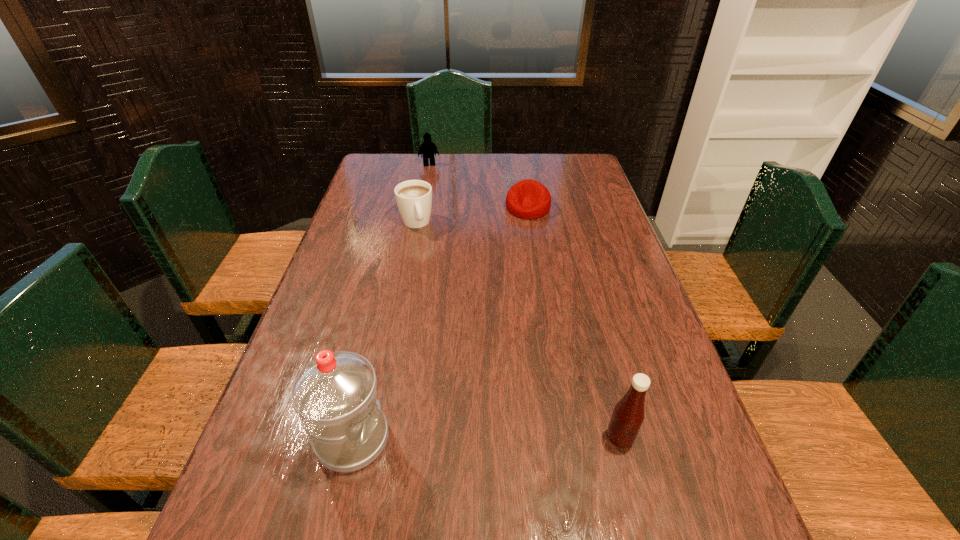
I want to click on free space between the second object from right to left and the second tallest object, so click(x=574, y=323).

Image resolution: width=960 pixels, height=540 pixels. I want to click on empty space that is in between the water bottle and the fourth shortest object, so click(x=486, y=438).

Locate an element on the screen. This screenshot has height=540, width=960. blank region between the tallest object and the farthest object is located at coordinates (391, 302).

The image size is (960, 540). I want to click on free point between the second tallest object and the water bottle, so click(486, 438).

I want to click on vacant point located between the farthest object and the beanbag, so click(478, 186).

Find the location of a particular element. vacant point located between the tallest object and the Lego is located at coordinates (391, 302).

Image resolution: width=960 pixels, height=540 pixels. Identify the location of free space between the tallest object and the Lego. (391, 302).

Identify which object is the third closest to the fourth shortest object. Please provide its 2D coordinates. Your answer should be formatted as a tuple, i.e. [(x, y)], where the tuple contains the x and y coordinates of a point satisfying the conditions above.

[(413, 197)]

Select which object is the second closest to the tallest object. Please provide its 2D coordinates. Your answer should be formatted as a tuple, i.e. [(x, y)], where the tuple contains the x and y coordinates of a point satisfying the conditions above.

[(413, 197)]

The image size is (960, 540). In order to click on vacant position in the image that satisfies the following two spatial constraints: 1. on the back side of the cappuccino; 2. on the left side of the Lego in this screenshot , I will do `click(427, 165)`.